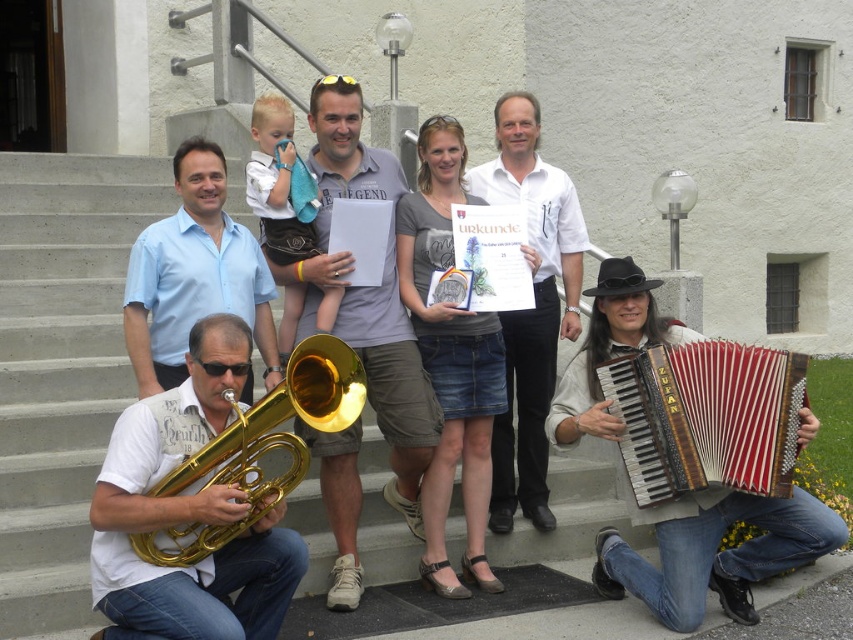
You are a photographer standing at the bottom of the stairs. You need to take a photo of the gold brass tuba at center and the gold brass tuba at lower left. Which tuba is higher up in the frame?

The gold brass tuba at center is higher up in the frame because it is above the gold brass tuba at lower left.